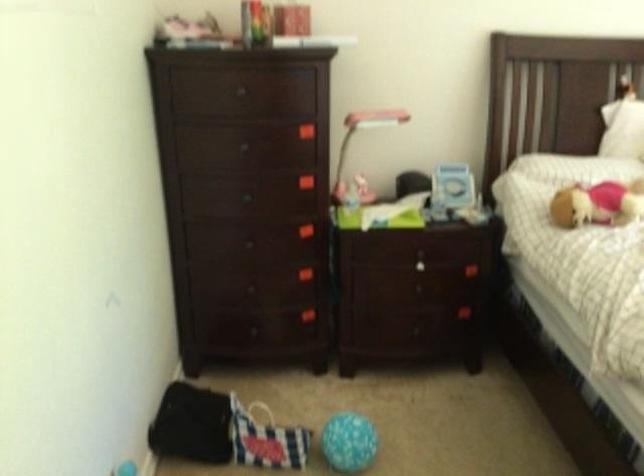
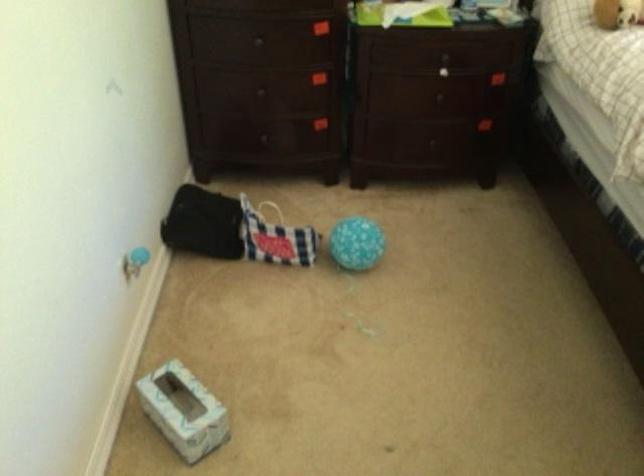
The point at (417, 268) is marked in the first image. Where is the corresponding point in the second image?

(442, 71)